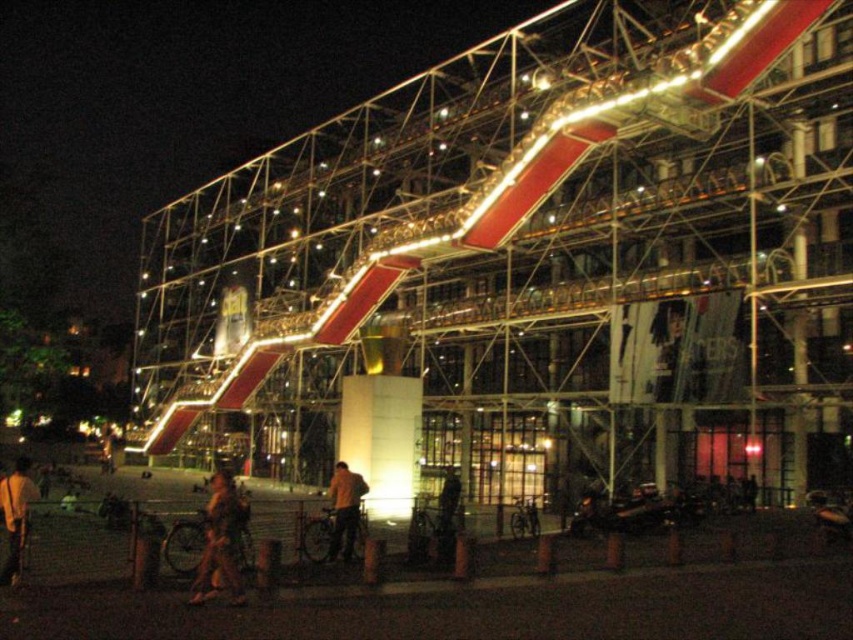
Is camouflage fabric jacket at lower center below yellow fabric jacket at center?

Indeed, camouflage fabric jacket at lower center is positioned under yellow fabric jacket at center.

Which is behind, point (235, 531) or point (346, 465)?

The point (346, 465) is more distant.

Where is `camouflage fabric jacket at lower center`? camouflage fabric jacket at lower center is located at coordinates (219, 541).